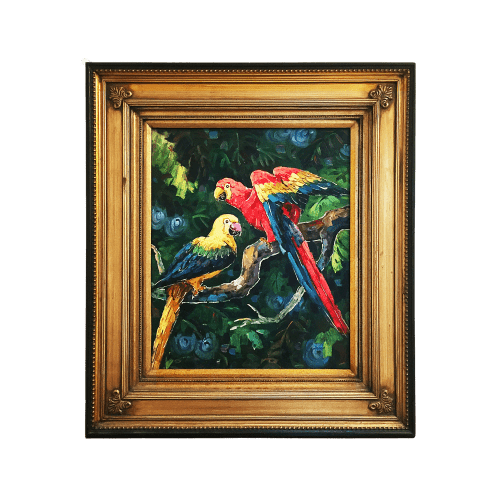
Where is `picture`? This screenshot has height=500, width=500. picture is located at coordinates (119, 302).